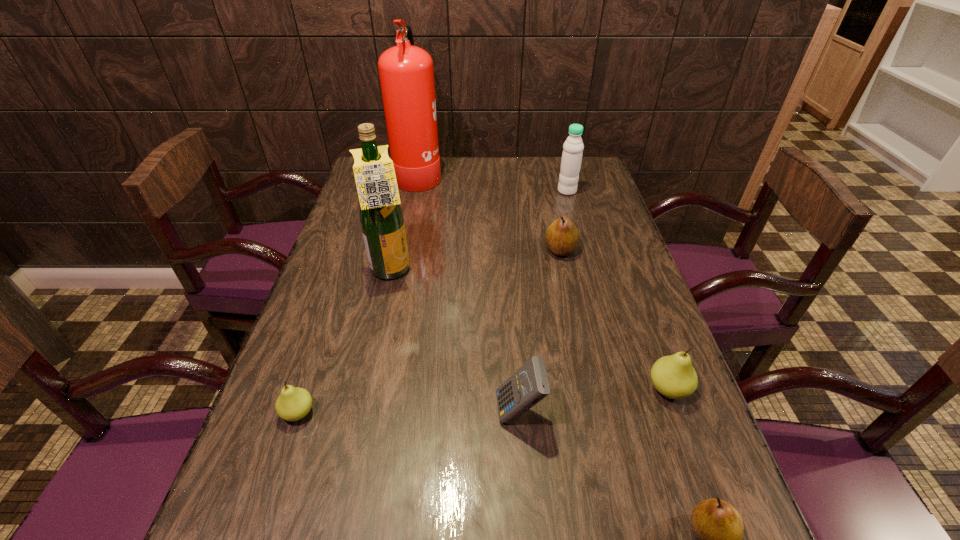
You are a GUI agent. You are given a task and a screenshot of the screen. Output one action in this format:
    pyautogui.click(x=<x>, y=<y>)
    Task: Click on the vacant space at the right edge
    The height and width of the screenshot is (540, 960).
    Given the screenshot: What is the action you would take?
    pyautogui.click(x=616, y=244)

Image resolution: width=960 pixels, height=540 pixels. What are the coordinates of `vacant point at the far right corner` in the screenshot? It's located at (553, 161).

You are a GUI agent. You are given a task and a screenshot of the screen. Output one action in this format:
    pyautogui.click(x=<x>, y=<y>)
    Task: Click on the free space that is in between the blue calculator and the liquor
    The height and width of the screenshot is (540, 960).
    Given the screenshot: What is the action you would take?
    pyautogui.click(x=455, y=343)

This screenshot has height=540, width=960. In order to click on free spot between the leftmost pear and the tallest object in this screenshot , I will do `click(359, 293)`.

I want to click on empty location between the liquor and the right green pear, so click(x=530, y=331).

At what (x,y) coordinates should I click in order to perform the action: click on vacant space that's between the smaller green pear and the sixth shortest object. Please return your answer as a coordinate pair (x, y). The width and height of the screenshot is (960, 540). Looking at the image, I should click on (433, 302).

This screenshot has height=540, width=960. Identify the location of vacant point located between the red fire extinguisher and the liquor. (405, 223).

Select which object appears as the sixth closest to the calculator. Please provide its 2D coordinates. Your answer should be formatted as a tuple, i.e. [(x, y)], where the tuple contains the x and y coordinates of a point satisfying the conditions above.

[(573, 147)]

Select which object appears as the fifth closest to the seventh shortest object. Please provide its 2D coordinates. Your answer should be formatted as a tuple, i.e. [(x, y)], where the tuple contains the x and y coordinates of a point satisfying the conditions above.

[(573, 147)]

In order to click on the second closest pear relative to the farthest pear in this screenshot , I will do `click(717, 525)`.